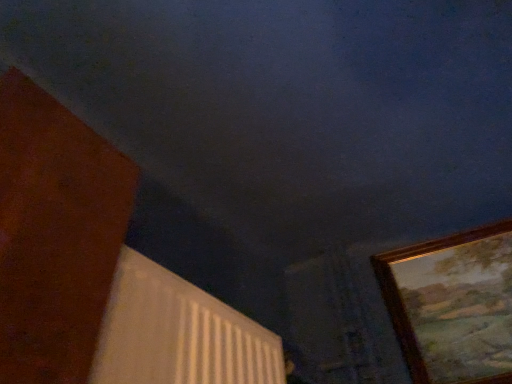
Question: Is point (500, 370) closer or farther from the camera than point (113, 314)?

Choices:
 (A) farther
 (B) closer

Answer: (A)

Question: From a real-world perspective, is gold-framed painting at right positioned above or below white textured radiator at lower center?

Choices:
 (A) below
 (B) above

Answer: (B)

Question: Is gold-framed painting at right inside the boundaries of white textured radiator at lower center, or outside?

Choices:
 (A) outside
 (B) inside

Answer: (A)

Question: In terms of width, does white textured radiator at lower center look wider or thinner when compared to gold-framed painting at right?

Choices:
 (A) wide
 (B) thin

Answer: (A)

Question: Does point (225, 380) appear closer or farther from the camera than point (480, 349)?

Choices:
 (A) farther
 (B) closer

Answer: (B)

Question: In the image, is white textured radiator at lower center positioned in front of or behind gold-framed painting at right?

Choices:
 (A) front
 (B) behind

Answer: (A)

Question: From a real-world perspective, is white textured radiator at lower center above or below gold-framed painting at right?

Choices:
 (A) below
 (B) above

Answer: (A)